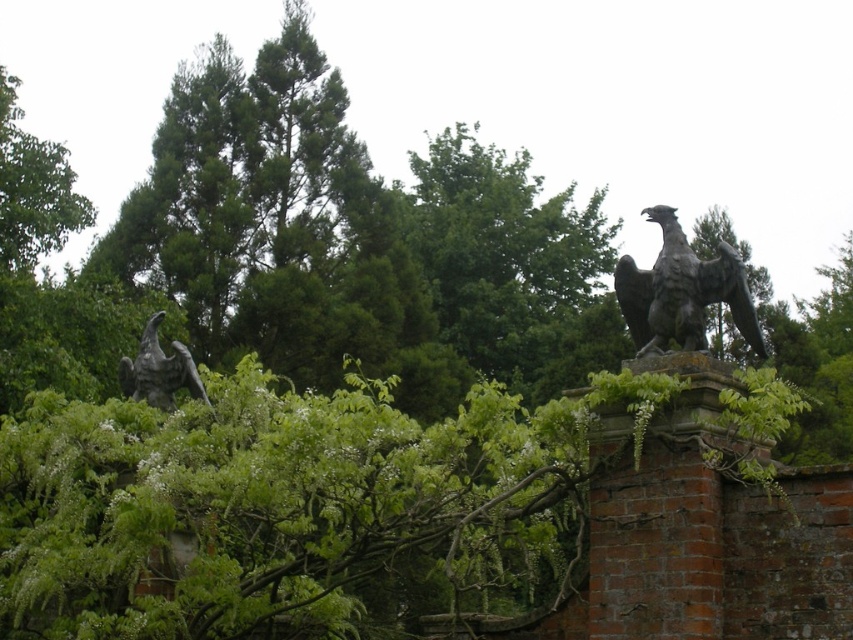
You are standing in the garden and want to place a small potted plant exactly at point (682,291). Which object is located at that coordinate?

The point (682,291) is on the polished bronze eagle at upper right.

You are a visitor in the garden and want to take a photo of both the polished bronze eagle at upper right and the polished bronze eagle at left. Which eagle should you focus on first if you want to capture both in a single frame without moving the camera?

The polished bronze eagle at upper right is larger than the polished bronze eagle at left, so focusing on the larger one first would ensure it fits well in the frame, allowing space for the smaller one as well.

Looking at this image, you are a visitor in the garden and want to take a photo of both polished bronze eagle at upper right and polished bronze eagle at left. Which eagle should you position closer to the camera to include both in the frame?

You should position the polished bronze eagle at upper right closer to the camera since it is already in front of the polished bronze eagle at left, making it naturally closer to the viewer.